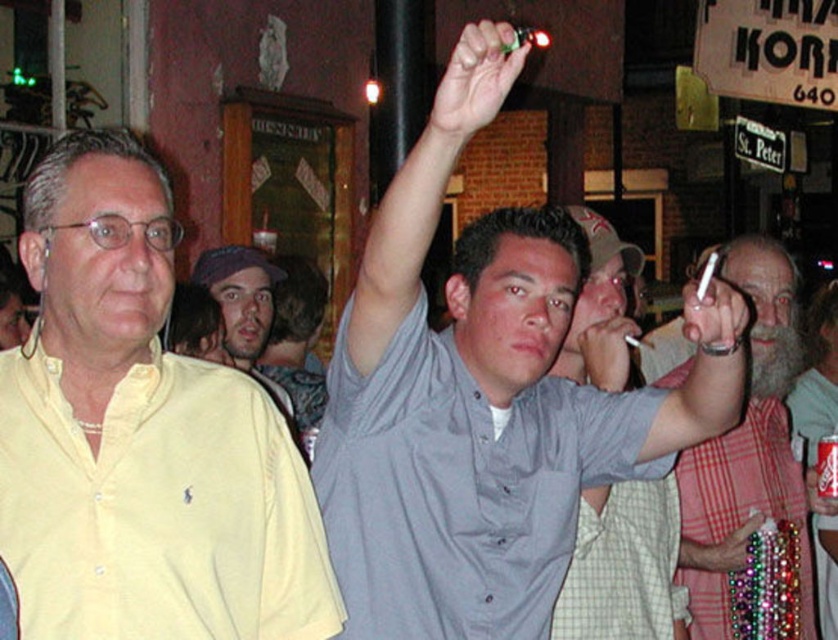
Who is higher up, gray fabric shirt at upper center or green matte object at upper center?

green matte object at upper center is higher up.

Can you confirm if gray fabric shirt at upper center is smaller than green matte object at upper center?

No.

The image size is (838, 640). Describe the element at coordinates (747, 449) in the screenshot. I see `gray fabric shirt at upper center` at that location.

Identify the location of gray fabric shirt at upper center. The image size is (838, 640). (747, 449).

Is gray matte shirt at upper center below yellow cotton shirt at left?

No, gray matte shirt at upper center is not below yellow cotton shirt at left.

Between point (552, 582) and point (123, 380), which one is positioned behind?

The point (552, 582) is more distant.

Where is `gray matte shirt at upper center`? gray matte shirt at upper center is located at coordinates (476, 422).

Can you confirm if red plaid shirt at right is shorter than matte gray shirt at upper center?

Incorrect, red plaid shirt at right's height does not fall short of matte gray shirt at upper center's.

Does red plaid shirt at right appear on the left side of matte gray shirt at upper center?

Incorrect, red plaid shirt at right is not on the left side of matte gray shirt at upper center.

At what (x,y) coordinates should I click in order to perform the action: click on red plaid shirt at right. Please return your answer as a coordinate pair (x, y). Image resolution: width=838 pixels, height=640 pixels. Looking at the image, I should click on (816, 376).